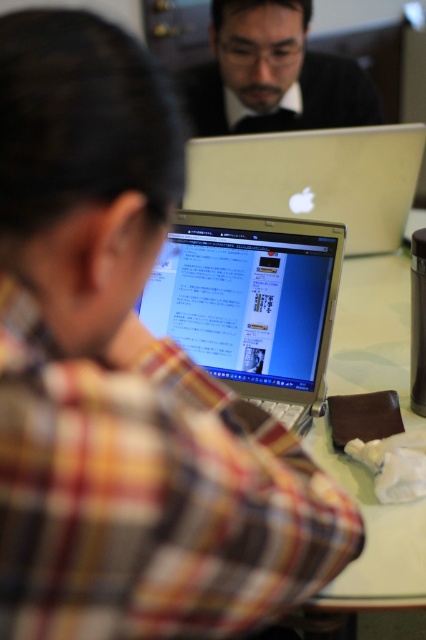
You are standing in front of the table where two people are working on laptops. There are two points marked on the table surface at coordinates point (x=353, y=136) and point (x=288, y=51). Which point is closer to you?

Point (x=353, y=136) is closer to the viewer than point (x=288, y=51).

You are organizing a tech fair and need to place two laptops on a table. The silver metallic laptop at center and the matte black laptop at upper center are available. If the table has limited space, which laptop should you choose to fit better?

The silver metallic laptop at center has a smaller size compared to the matte black laptop at upper center, so it will fit better in the limited space.